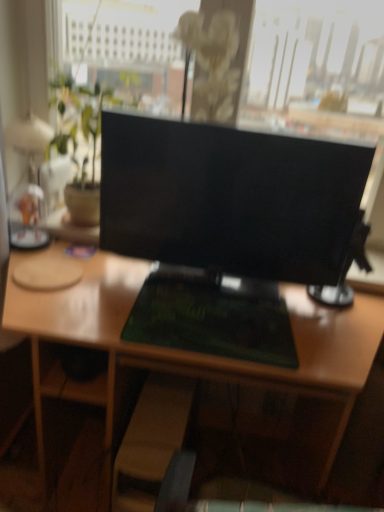
Question: Does green matte desk at center contain wooden swivel chair at lower center?

Choices:
 (A) no
 (B) yes

Answer: (B)

Question: From a real-world perspective, is green matte desk at center on top of wooden swivel chair at lower center?

Choices:
 (A) no
 (B) yes

Answer: (B)

Question: Is green matte desk at center smaller than wooden swivel chair at lower center?

Choices:
 (A) yes
 (B) no

Answer: (B)

Question: Is green matte desk at center to the right of wooden swivel chair at lower center from the viewer's perspective?

Choices:
 (A) no
 (B) yes

Answer: (B)

Question: Is green matte desk at center further to camera compared to wooden swivel chair at lower center?

Choices:
 (A) no
 (B) yes

Answer: (A)

Question: Is point (246, 244) positioned closer to the camera than point (172, 423)?

Choices:
 (A) farther
 (B) closer

Answer: (B)

Question: Which is correct: black glossy monitor at center is inside wooden swivel chair at lower center, or outside of it?

Choices:
 (A) outside
 (B) inside

Answer: (A)

Question: From the image's perspective, is black glossy monitor at center located above or below wooden swivel chair at lower center?

Choices:
 (A) above
 (B) below

Answer: (A)

Question: Relative to wooden swivel chair at lower center, is black glossy monitor at center in front or behind?

Choices:
 (A) behind
 (B) front

Answer: (B)

Question: Is black glossy monitor at center inside or outside of green matte desk at center?

Choices:
 (A) outside
 (B) inside

Answer: (A)

Question: Based on their positions, is black glossy monitor at center located to the left or right of green matte desk at center?

Choices:
 (A) left
 (B) right

Answer: (B)

Question: In the image, is black glossy monitor at center positioned in front of or behind green matte desk at center?

Choices:
 (A) front
 (B) behind

Answer: (B)

Question: Is black glossy monitor at center wider or thinner than green matte desk at center?

Choices:
 (A) thin
 (B) wide

Answer: (A)

Question: From their relative heights in the image, would you say wooden swivel chair at lower center is taller or shorter than black glossy monitor at center?

Choices:
 (A) tall
 (B) short

Answer: (B)

Question: From the image's perspective, relative to black glossy monitor at center, is wooden swivel chair at lower center above or below?

Choices:
 (A) below
 (B) above

Answer: (A)